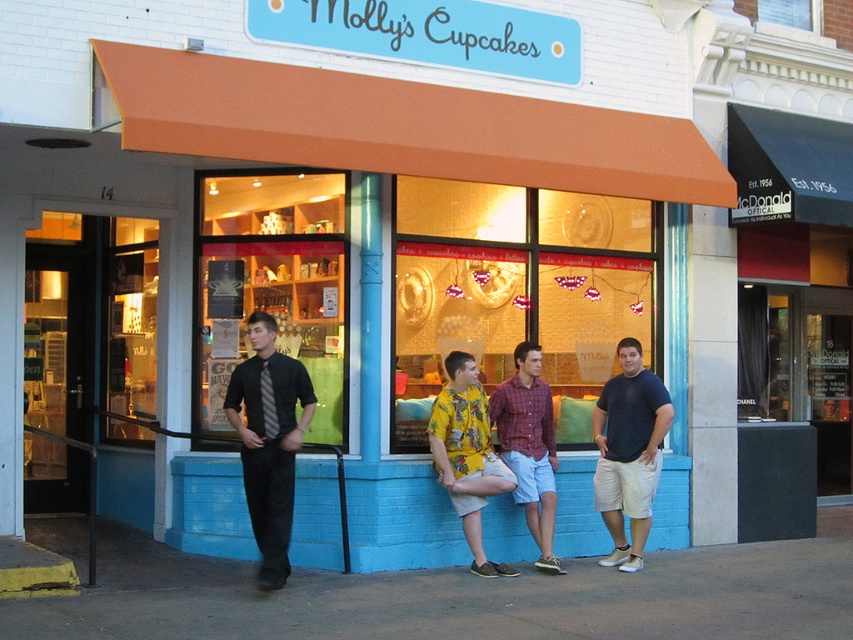
Question: Considering the relative positions of matte blue t-shirt at center and plaid cotton shirt at center in the image provided, where is matte blue t-shirt at center located with respect to plaid cotton shirt at center?

Choices:
 (A) right
 (B) left

Answer: (A)

Question: Can you confirm if matte black shirt at left is bigger than yellow printed shirt at center?

Choices:
 (A) yes
 (B) no

Answer: (B)

Question: Which point is closer to the camera taking this photo?

Choices:
 (A) tap(598, 483)
 (B) tap(555, 561)
 (C) tap(287, 448)
 (D) tap(444, 449)

Answer: (C)

Question: Observing the image, what is the correct spatial positioning of matte black shirt at left in reference to matte blue t-shirt at center?

Choices:
 (A) left
 (B) right

Answer: (A)

Question: Which of these objects is positioned closest to the yellow printed shirt at center?

Choices:
 (A) matte black shirt at left
 (B) plaid cotton shirt at center

Answer: (B)

Question: Which object is farther from the camera taking this photo?

Choices:
 (A) matte black shirt at left
 (B) matte blue t-shirt at center
 (C) yellow printed shirt at center
 (D) plaid cotton shirt at center

Answer: (B)